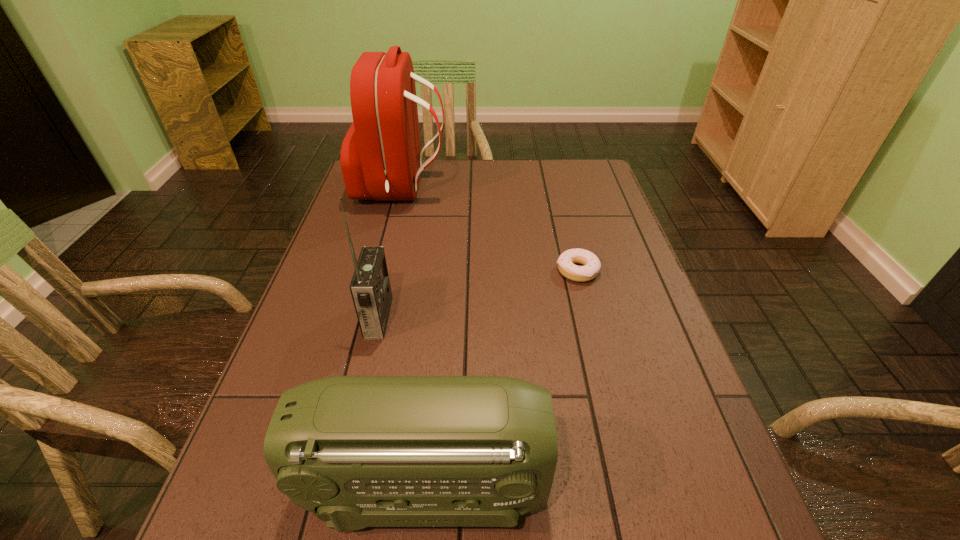
Where is `the farthest object`? the farthest object is located at coordinates (380, 157).

You are a GUI agent. You are given a task and a screenshot of the screen. Output one action in this format:
    pyautogui.click(x=<x>, y=<y>)
    Task: Click on the tallest object
    This screenshot has width=960, height=540.
    Given the screenshot: What is the action you would take?
    pyautogui.click(x=380, y=157)

This screenshot has height=540, width=960. I want to click on the second nearest object, so click(x=370, y=288).

Where is `the taller radio_receiver`? This screenshot has width=960, height=540. the taller radio_receiver is located at coordinates (370, 288).

The width and height of the screenshot is (960, 540). Find the location of `the shortest object`. the shortest object is located at coordinates (566, 262).

The image size is (960, 540). Identify the location of the rightmost object. (566, 262).

Identify the location of free space located 0.340m on the strap side of the farthest object. This screenshot has width=960, height=540. (551, 189).

This screenshot has width=960, height=540. In order to click on vacant space located 0.370m on the display of the second nearest object in this screenshot , I will do `click(550, 317)`.

Identify the location of blank space located 0.400m on the left of the doughnut. (400, 271).

The width and height of the screenshot is (960, 540). Find the location of `object located in the far edge section of the desktop`. object located in the far edge section of the desktop is located at coordinates (x=380, y=157).